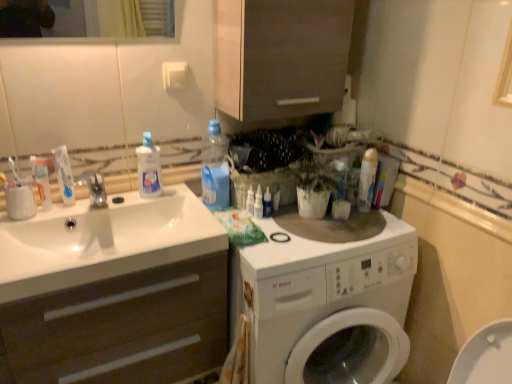
At what (x,y) coordinates should I click in order to perform the action: click on free point in front of white glossy spray can at upper right, the 1th cleaning product from the right. Please return your answer as a coordinate pair (x, y). The width and height of the screenshot is (512, 384). Looking at the image, I should click on (376, 228).